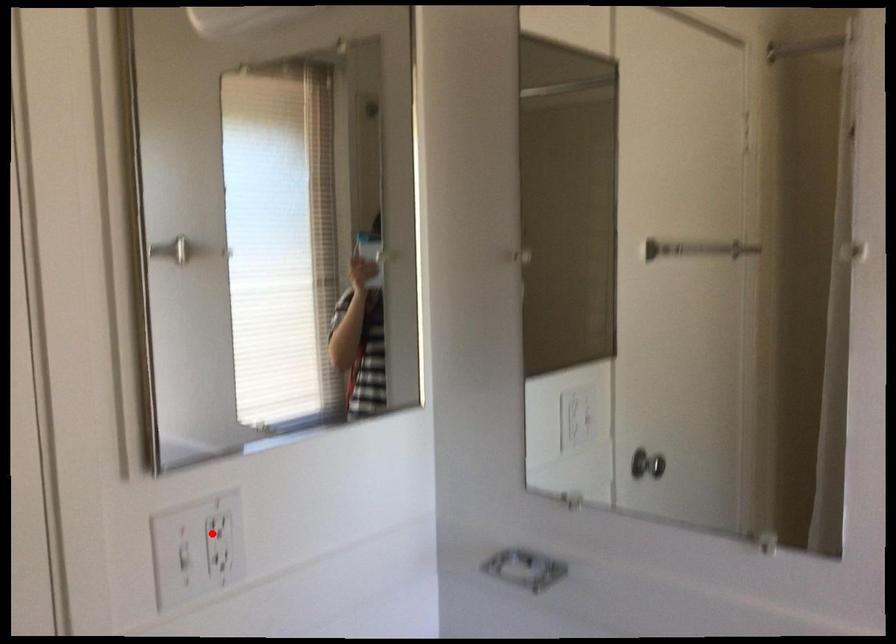
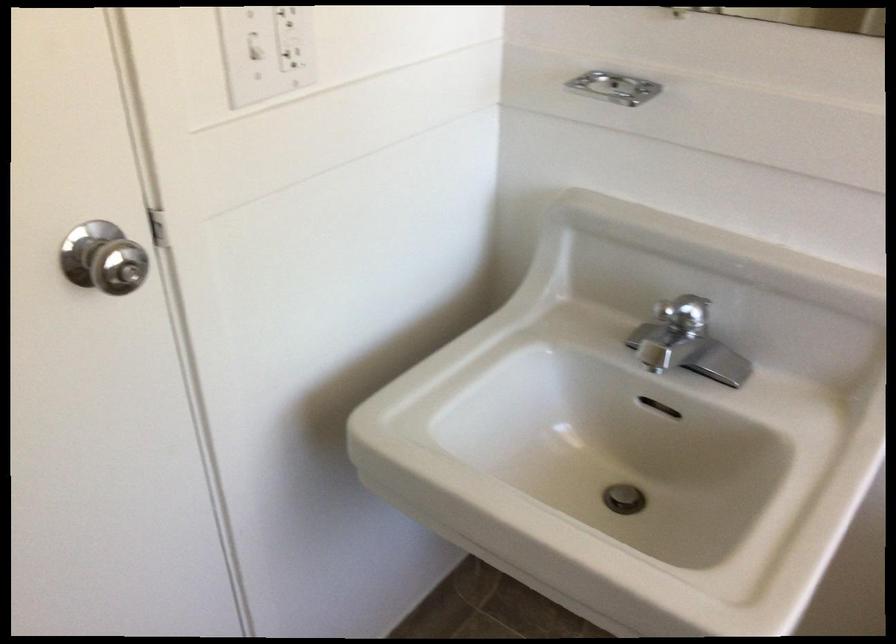
Question: A red point is marked in image1. In image2, is the corresponding 3D point closer to the camera or farther? Reply with the corresponding letter.

Choices:
 (A) The corresponding 3D point is closer.
 (B) The corresponding 3D point is farther.

Answer: (A)